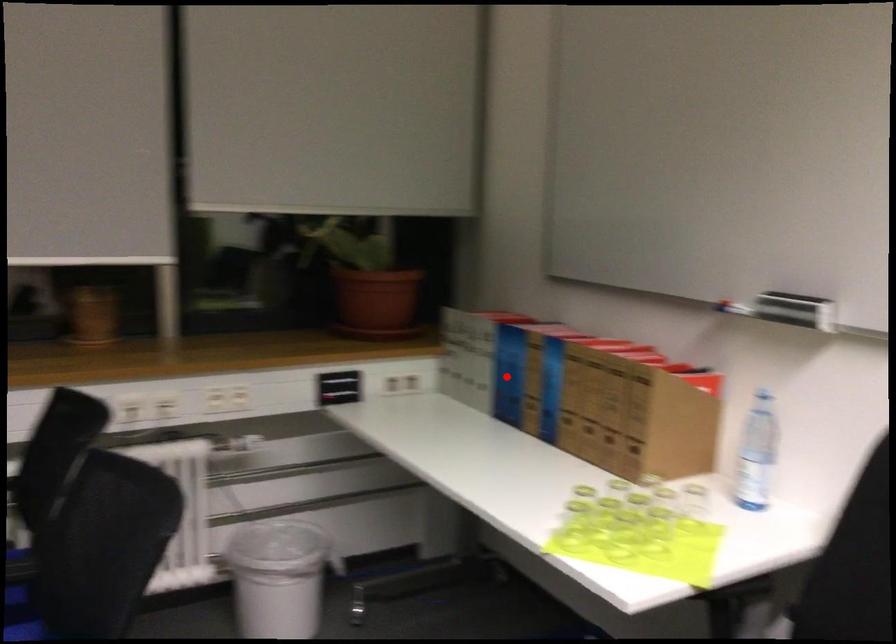
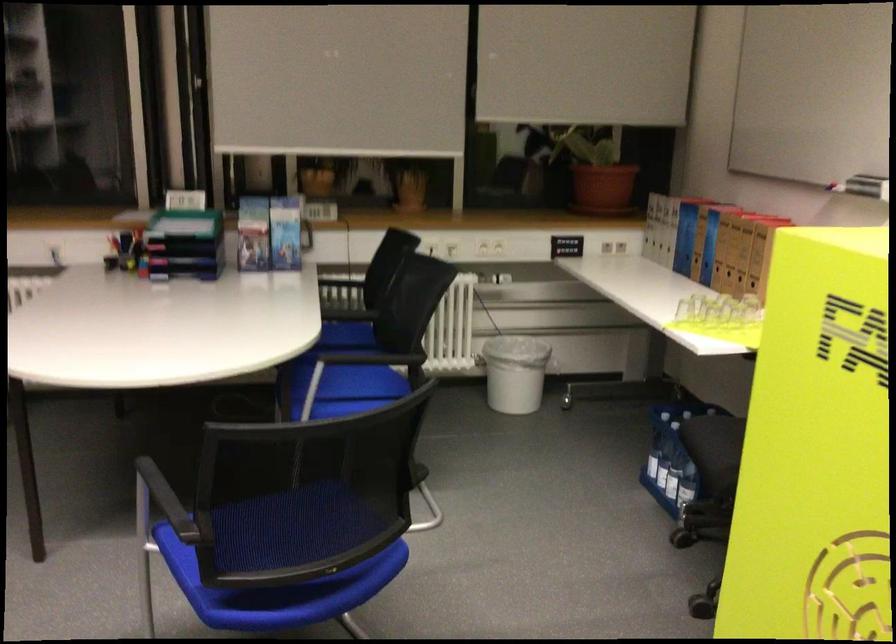
Question: I am providing you with two images of the same scene from different viewpoints. A red point is shown in image1. For the corresponding object point in image2, is it positioned nearer or farther from the camera?

Choices:
 (A) Nearer
 (B) Farther

Answer: (B)